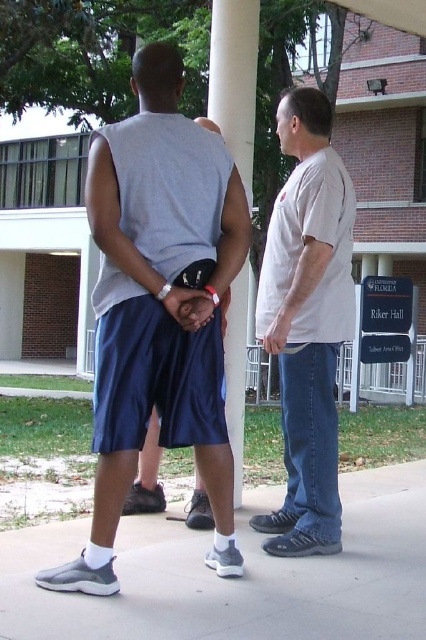
Does white matte t-shirt at center have a greater height compared to white smooth pillar at center?

Yes, white matte t-shirt at center is taller than white smooth pillar at center.

Does point (282, 512) lie in front of point (241, 180)?

That is False.

At what (x,y) coordinates should I click in order to perform the action: click on white matte t-shirt at center. Please return your answer as a coordinate pair (x, y). The height and width of the screenshot is (640, 426). Looking at the image, I should click on (307, 323).

Is point (270, 531) positioned behind point (422, 316)?

No, (270, 531) is closer to viewer.

Does point (259, 273) lie in front of point (368, 259)?

Yes, point (259, 273) is closer to viewer.

At what (x,y) coordinates should I click in order to perform the action: click on white matte t-shirt at center. Please return your answer as a coordinate pair (x, y). The image size is (426, 640). Looking at the image, I should click on point(307,323).

Does blue satin shorts at center have a greater height compared to gray rubber shoe at lower center?

Yes, blue satin shorts at center is taller than gray rubber shoe at lower center.

Does blue satin shorts at center come behind gray rubber shoe at lower center?

Yes, it is behind gray rubber shoe at lower center.

Who is more forward, (161, 381) or (253, 636)?

Point (253, 636) is in front.

Locate an element on the screen. Image resolution: width=426 pixels, height=640 pixels. blue satin shorts at center is located at coordinates (158, 307).